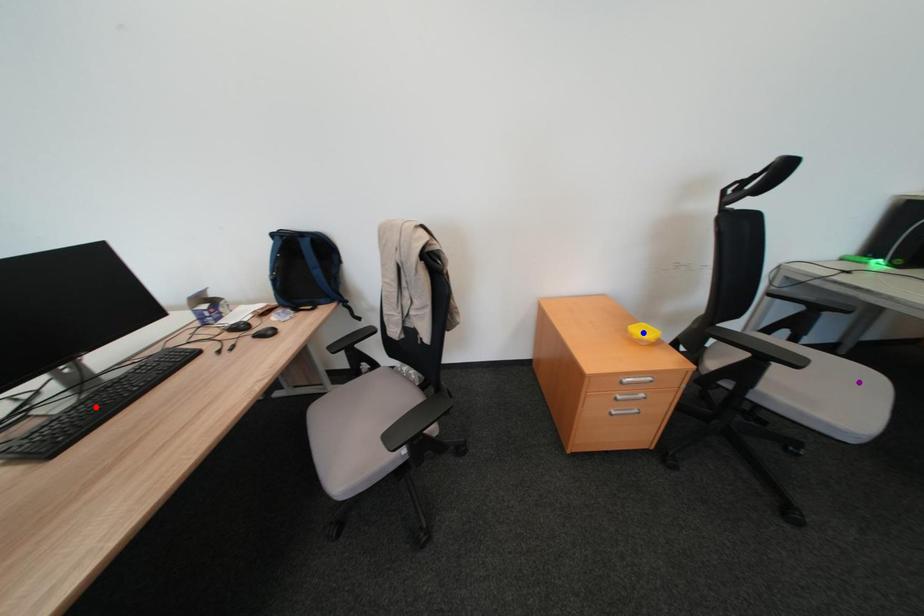
Order these from nearest to farthest:
purple point
blue point
red point

purple point
blue point
red point